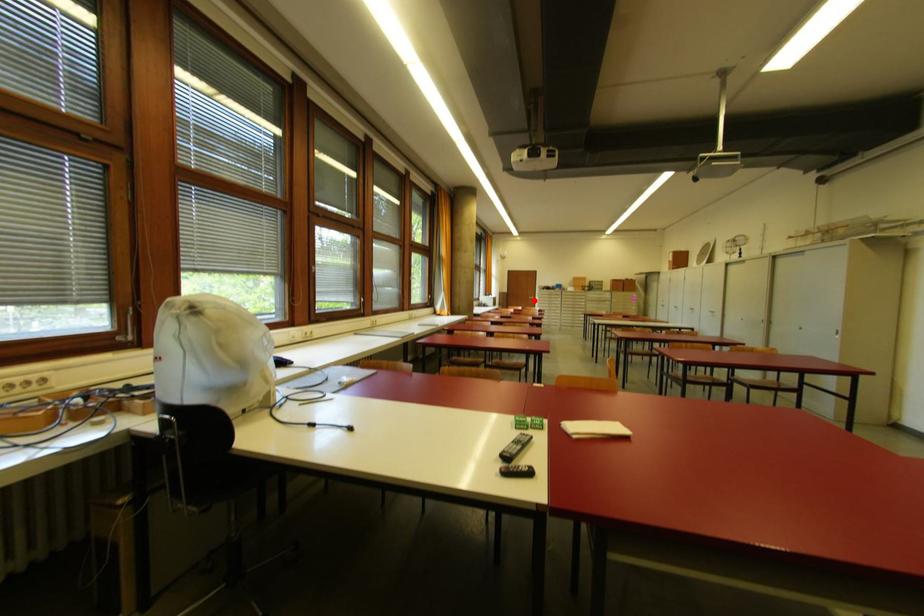
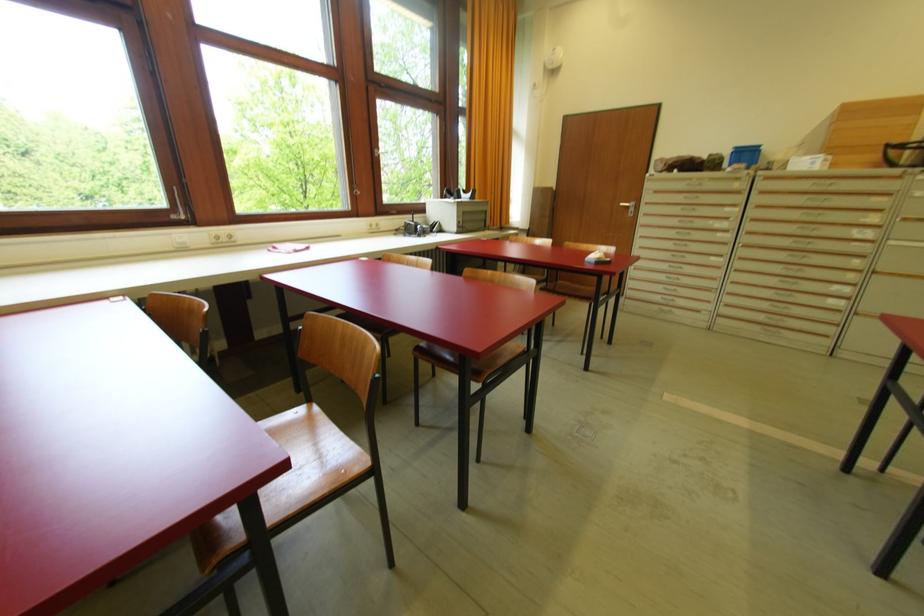
Question: A red point is marked in image1. In image2, is the corresponding 3D point closer to the camera or farther? Reply with the corresponding letter.

Choices:
 (A) The corresponding 3D point is closer.
 (B) The corresponding 3D point is farther.

Answer: (B)